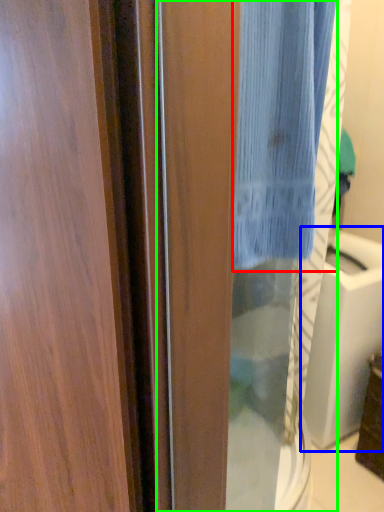
Question: Estimate the real-world distances between objects in this image. Which object is closer to curtain (highlighted by a red box), sink (highlighted by a blue box) or screen door (highlighted by a green box)?

Choices:
 (A) sink
 (B) screen door

Answer: (B)